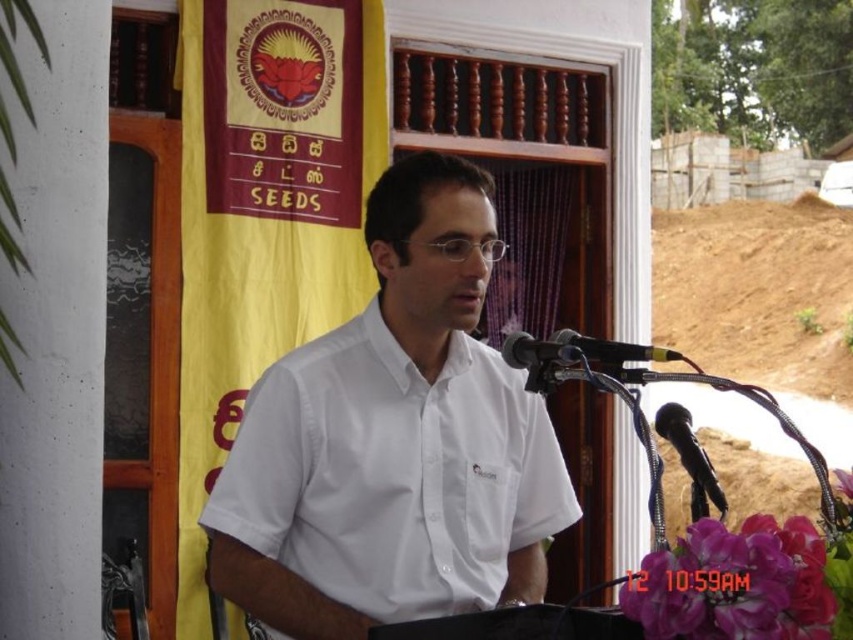
Question: Estimate the real-world distances between objects in this image. Which object is closer to the white smooth shirt at center?

Choices:
 (A) black plastic microphone at lower right
 (B) black plastic microphone at center

Answer: (B)

Question: Does white smooth shirt at center have a larger size compared to black plastic microphone at center?

Choices:
 (A) yes
 (B) no

Answer: (A)

Question: Which of the following is the closest to the observer?

Choices:
 (A) white smooth shirt at center
 (B) black plastic microphone at lower right
 (C) black metallic microphone at center
 (D) black plastic microphone at center

Answer: (B)

Question: Where is black plastic microphone at lower right located in relation to black plastic microphone at center in the image?

Choices:
 (A) left
 (B) right

Answer: (B)

Question: Which of the following is the closest to the observer?

Choices:
 (A) black plastic microphone at lower right
 (B) black plastic microphone at center
 (C) black metallic microphone at center

Answer: (A)

Question: Is black metallic microphone at center further to camera compared to black plastic microphone at center?

Choices:
 (A) yes
 (B) no

Answer: (A)